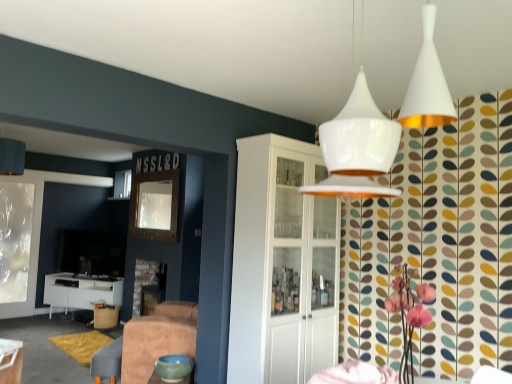
Question: Is white glossy table at lower left, which is the first table from left to right, beside white glossy cabinet at center?

Choices:
 (A) yes
 (B) no

Answer: (B)

Question: From the image's perspective, does white glossy table at lower left, which is the first table from left to right, appear lower than white glossy cabinet at center?

Choices:
 (A) yes
 (B) no

Answer: (A)

Question: Considering the relative sizes of white glossy table at lower left, which appears as the second table when viewed from the top, and white glossy cabinet at center in the image provided, is white glossy table at lower left, which appears as the second table when viewed from the top, bigger than white glossy cabinet at center?

Choices:
 (A) yes
 (B) no

Answer: (B)

Question: Is white glossy table at lower left, the 2th table when ordered from right to left, smaller than white glossy cabinet at center?

Choices:
 (A) yes
 (B) no

Answer: (A)

Question: Considering the relative positions of white glossy table at lower left, which ranks as the 2th table in front-to-back order, and white glossy cabinet at center in the image provided, is white glossy table at lower left, which ranks as the 2th table in front-to-back order, to the left of white glossy cabinet at center from the viewer's perspective?

Choices:
 (A) yes
 (B) no

Answer: (A)

Question: Considering the relative sizes of white glossy table at lower left, which ranks as the 1th table in bottom-to-top order, and white glossy cabinet at center in the image provided, is white glossy table at lower left, which ranks as the 1th table in bottom-to-top order, shorter than white glossy cabinet at center?

Choices:
 (A) yes
 (B) no

Answer: (A)

Question: Is white glossy table at lower left, the 2th table when ordered from right to left, facing away from matte green bowl at lower center?

Choices:
 (A) yes
 (B) no

Answer: (B)

Question: From a real-world perspective, does white glossy table at lower left, which appears as the second table when viewed from the top, stand above matte green bowl at lower center?

Choices:
 (A) yes
 (B) no

Answer: (A)

Question: From a real-world perspective, does white glossy table at lower left, the 1th table from the back, sit lower than matte green bowl at lower center?

Choices:
 (A) no
 (B) yes

Answer: (A)

Question: Would you consider white glossy table at lower left, which ranks as the 1th table in bottom-to-top order, to be distant from matte green bowl at lower center?

Choices:
 (A) no
 (B) yes

Answer: (B)

Question: Is white glossy table at lower left, which ranks as the 1th table in bottom-to-top order, positioned in front of matte green bowl at lower center?

Choices:
 (A) no
 (B) yes

Answer: (A)

Question: Considering the relative sizes of white glossy table at lower left, the 2th table when ordered from right to left, and matte green bowl at lower center in the image provided, is white glossy table at lower left, the 2th table when ordered from right to left, thinner than matte green bowl at lower center?

Choices:
 (A) no
 (B) yes

Answer: (A)

Question: Does leather swivel chair at lower center have a lesser height compared to burlap stool at lower left?

Choices:
 (A) no
 (B) yes

Answer: (B)